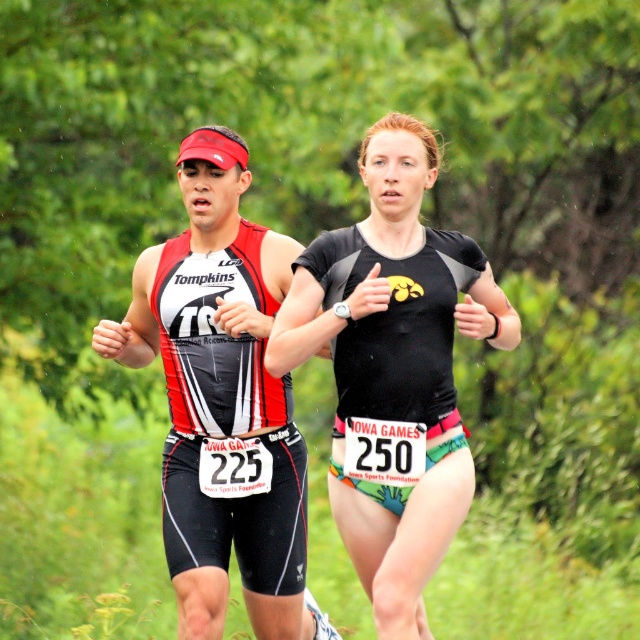
Question: Which object appears closest to the camera in this image?

Choices:
 (A) matte triathlon suit at center
 (B) black matte running suit at center

Answer: (B)

Question: Is black matte running suit at center closer to camera compared to matte triathlon suit at center?

Choices:
 (A) no
 (B) yes

Answer: (B)

Question: Is black matte running suit at center to the left of matte triathlon suit at center from the viewer's perspective?

Choices:
 (A) no
 (B) yes

Answer: (A)

Question: Can you confirm if black matte running suit at center is positioned to the right of matte triathlon suit at center?

Choices:
 (A) no
 (B) yes

Answer: (B)